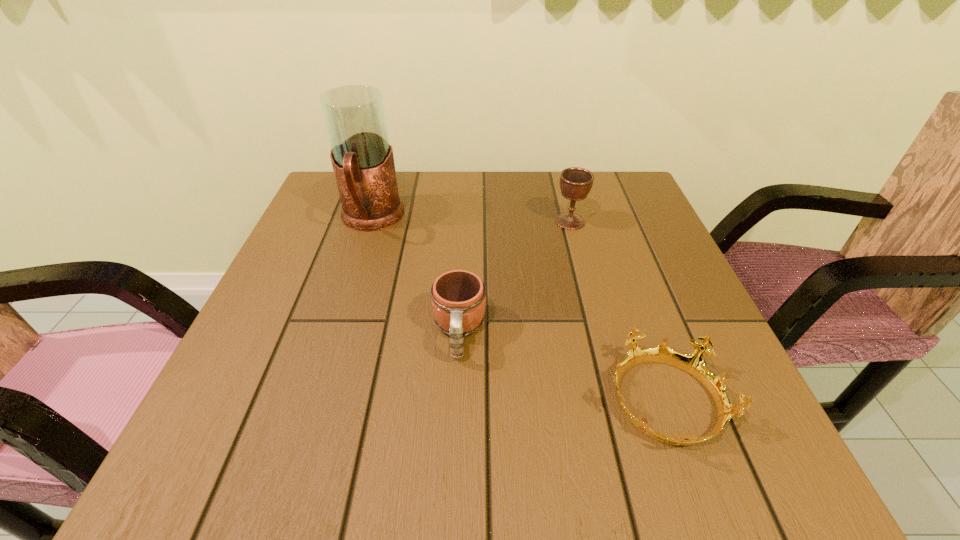
In order to click on pitcher that is positioned at the far edge in this screenshot , I will do `click(363, 163)`.

Locate an element on the screen. This screenshot has width=960, height=540. chalice situated at the far edge is located at coordinates (575, 183).

Find the location of a particular element. The image size is (960, 540). object that is at the near edge is located at coordinates (692, 363).

Identify the location of object that is at the left edge. The image size is (960, 540). (363, 163).

You are a GUI agent. You are given a task and a screenshot of the screen. Output one action in this format:
    pyautogui.click(x=<x>, y=<y>)
    Task: Click on the object positioned at the right edge
    This screenshot has height=540, width=960.
    Given the screenshot: What is the action you would take?
    pyautogui.click(x=692, y=363)

The width and height of the screenshot is (960, 540). I want to click on object that is at the far left corner, so click(x=363, y=163).

Where is `object positioned at the near right corner`? The width and height of the screenshot is (960, 540). object positioned at the near right corner is located at coordinates (692, 363).

Find the location of a particular element. This screenshot has width=960, height=540. blank space at the far edge of the desktop is located at coordinates (445, 181).

The width and height of the screenshot is (960, 540). In order to click on free space at the near edge of the desktop in this screenshot , I will do `click(396, 472)`.

Locate an element on the screen. The image size is (960, 540). vacant space at the left edge is located at coordinates (272, 425).